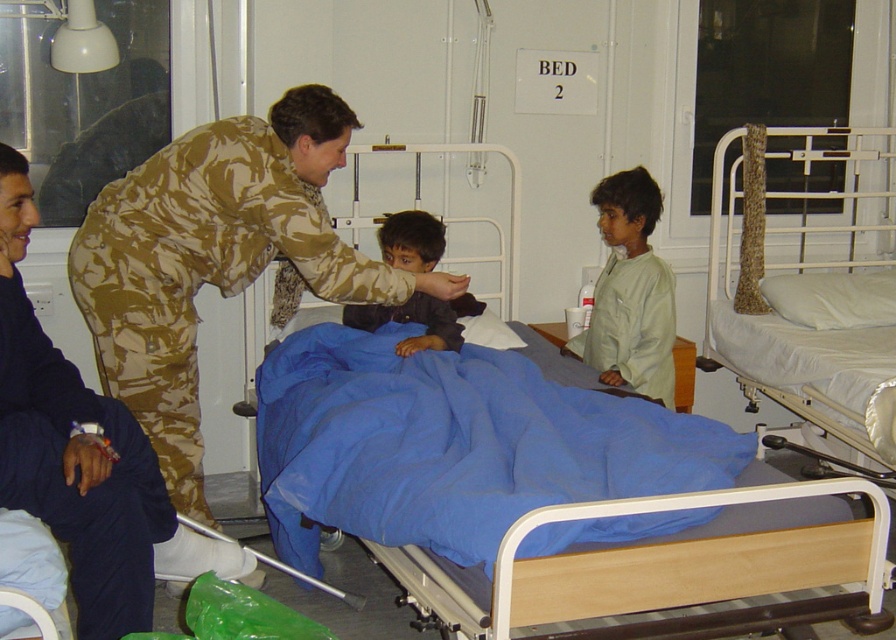
Which is more to the right, camouflage uniform at center or light beige fabric shirt at center?

light beige fabric shirt at center is more to the right.

Find the location of a particular element. This screenshot has height=640, width=896. camouflage uniform at center is located at coordinates (216, 259).

The height and width of the screenshot is (640, 896). Identify the location of camouflage uniform at center. (216, 259).

Does point (863, 324) come in front of point (595, 205)?

Yes, it is.

The height and width of the screenshot is (640, 896). Describe the element at coordinates (815, 294) in the screenshot. I see `white fabric bed at right` at that location.

Locate an element on the screen. white fabric bed at right is located at coordinates (815, 294).

Does camouflage uniform at left have a lesser width compared to light beige fabric shirt at center?

Incorrect, camouflage uniform at left's width is not less than light beige fabric shirt at center's.

Describe the element at coordinates (82, 456) in the screenshot. I see `camouflage uniform at left` at that location.

Where is `camouflage uniform at left`? This screenshot has width=896, height=640. camouflage uniform at left is located at coordinates (82, 456).